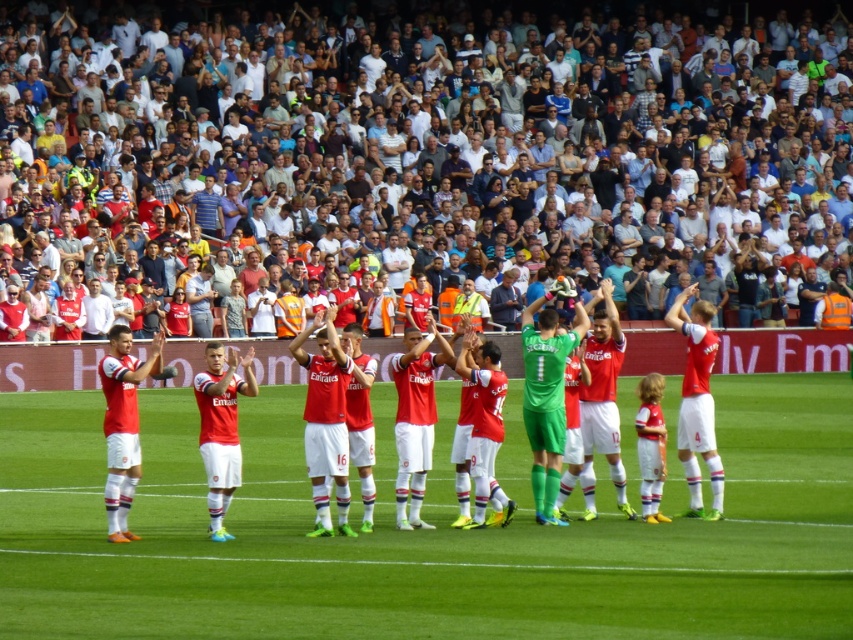
Question: Is green grass football field at center smaller than matte red jersey at center?

Choices:
 (A) yes
 (B) no

Answer: (A)

Question: Among these points, which one is farthest from the camera?

Choices:
 (A) (695, 26)
 (B) (495, 369)
 (C) (808, 634)

Answer: (A)

Question: Which point is farther to the camera?

Choices:
 (A) (299, 518)
 (B) (596, 321)

Answer: (B)

Question: Which of the following is the closest to the observer?

Choices:
 (A) white cotton crowd at upper center
 (B) green grass football field at center

Answer: (B)

Question: Can you confirm if green grass football field at center is wider than white cotton crowd at upper center?

Choices:
 (A) no
 (B) yes

Answer: (A)

Question: Is white cotton crowd at upper center further to the viewer compared to matte red jersey at center?

Choices:
 (A) yes
 (B) no

Answer: (A)